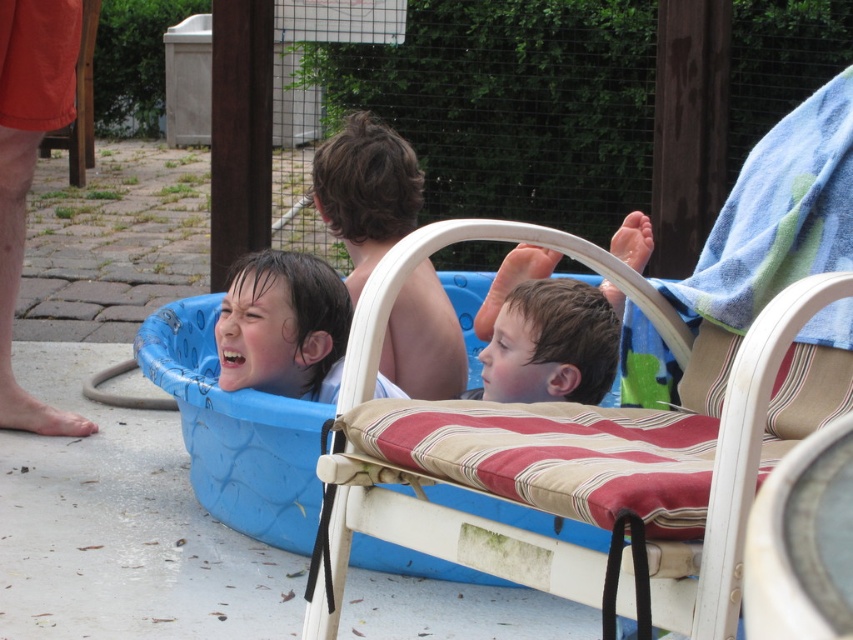
Can you confirm if white striped cushioned beach chair at center is positioned to the right of shiny brown hair at center?

Indeed, white striped cushioned beach chair at center is positioned on the right side of shiny brown hair at center.

Who is taller, white striped cushioned beach chair at center or shiny brown hair at center?

white striped cushioned beach chair at center

This screenshot has width=853, height=640. Identify the location of white striped cushioned beach chair at center. (635, 408).

Which is below, shiny brown hair at center or wet brown hair at center?

wet brown hair at center is below.

Is point (433, 388) more distant than point (614, 241)?

Yes.

In order to click on shiny brown hair at center in this screenshot , I will do point(366,192).

Find the location of a particular element. The height and width of the screenshot is (640, 853). shiny brown hair at center is located at coordinates (366, 192).

Between point (383, 269) and point (618, 234), which one is positioned behind?

Positioned behind is point (618, 234).

Between point (619, 420) and point (474, 321), which one is positioned in front?

Point (619, 420)

The image size is (853, 640). What are the coordinates of `white striped cushioned beach chair at center` in the screenshot? It's located at click(635, 408).